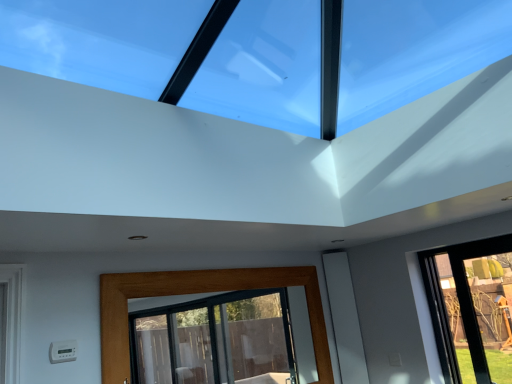
The height and width of the screenshot is (384, 512). Describe the element at coordinates (197, 293) in the screenshot. I see `wooden-framed glass door at lower center, marked as the 1th window in a bottom-to-top arrangement` at that location.

At what (x,y) coordinates should I click in order to perform the action: click on wooden-framed glass door at lower center, which is counted as the second window, starting from the top. Please return your answer as a coordinate pair (x, y). Looking at the image, I should click on (197, 293).

How much space does wooden-framed glass door at lower center, which is counted as the second window, starting from the top, occupy horizontally?

wooden-framed glass door at lower center, which is counted as the second window, starting from the top, is 1.55 inches wide.

Measure the distance between point (341, 56) and camera.

The distance of point (341, 56) from camera is 4.03 meters.

Image resolution: width=512 pixels, height=384 pixels. I want to click on transparent glass window at upper center, placed as the 1th window when sorted from top to bottom, so click(x=261, y=53).

The width and height of the screenshot is (512, 384). Describe the element at coordinates (261, 53) in the screenshot. I see `transparent glass window at upper center, which ranks as the second window in bottom-to-top order` at that location.

At what (x,y) coordinates should I click in order to perform the action: click on wooden-framed glass door at lower center, which is counted as the second window, starting from the top. Please return your answer as a coordinate pair (x, y). Looking at the image, I should click on (197, 293).

Based on the photo, does wooden-framed glass door at lower center, which is counted as the second window, starting from the top, appear on the right side of transparent glass window at upper center, which ranks as the second window in bottom-to-top order?

In fact, wooden-framed glass door at lower center, which is counted as the second window, starting from the top, is to the left of transparent glass window at upper center, which ranks as the second window in bottom-to-top order.

Between wooden-framed glass door at lower center, marked as the 1th window in a bottom-to-top arrangement, and transparent glass window at upper center, placed as the 1th window when sorted from top to bottom, which one is positioned behind?

wooden-framed glass door at lower center, marked as the 1th window in a bottom-to-top arrangement, is more distant.

Considering the positions of point (112, 362) and point (246, 40), is point (112, 362) closer or farther from the camera than point (246, 40)?

Point (112, 362).

From the image's perspective, is wooden-framed glass door at lower center, which is counted as the second window, starting from the top, on top of transparent glass window at upper center, placed as the 1th window when sorted from top to bottom?

No.

From a real-world perspective, who is located lower, wooden-framed glass door at lower center, marked as the 1th window in a bottom-to-top arrangement, or transparent glass window at upper center, placed as the 1th window when sorted from top to bottom?

wooden-framed glass door at lower center, marked as the 1th window in a bottom-to-top arrangement, from a real-world perspective.

Between wooden-framed glass door at lower center, which is counted as the second window, starting from the top, and transparent glass window at upper center, placed as the 1th window when sorted from top to bottom, which one has larger width?

transparent glass window at upper center, placed as the 1th window when sorted from top to bottom, is wider.

Is wooden-framed glass door at lower center, marked as the 1th window in a bottom-to-top arrangement, taller or shorter than transparent glass window at upper center, which ranks as the second window in bottom-to-top order?

Considering their sizes, wooden-framed glass door at lower center, marked as the 1th window in a bottom-to-top arrangement, has more height than transparent glass window at upper center, which ranks as the second window in bottom-to-top order.

Looking at this image, looking at the image, does wooden-framed glass door at lower center, which is counted as the second window, starting from the top, seem bigger or smaller compared to transparent glass window at upper center, which ranks as the second window in bottom-to-top order?

In the image, wooden-framed glass door at lower center, which is counted as the second window, starting from the top, appears to be smaller than transparent glass window at upper center, which ranks as the second window in bottom-to-top order.

Is wooden-framed glass door at lower center, marked as the 1th window in a bottom-to-top arrangement, outside of transparent glass window at upper center, placed as the 1th window when sorted from top to bottom?

wooden-framed glass door at lower center, marked as the 1th window in a bottom-to-top arrangement, lies outside transparent glass window at upper center, placed as the 1th window when sorted from top to bottom,'s area.

Is the surface of wooden-framed glass door at lower center, marked as the 1th window in a bottom-to-top arrangement, in direct contact with transparent glass window at upper center, which ranks as the second window in bottom-to-top order?

No, wooden-framed glass door at lower center, marked as the 1th window in a bottom-to-top arrangement, is not beside transparent glass window at upper center, which ranks as the second window in bottom-to-top order.

Is wooden-framed glass door at lower center, which is counted as the second window, starting from the top, oriented away from transparent glass window at upper center, which ranks as the second window in bottom-to-top order?

No, wooden-framed glass door at lower center, which is counted as the second window, starting from the top,'s orientation is not away from transparent glass window at upper center, which ranks as the second window in bottom-to-top order.

How different are the orientations of wooden-framed glass door at lower center, which is counted as the second window, starting from the top, and transparent glass window at upper center, placed as the 1th window when sorted from top to bottom, in degrees?

There is a 90.1-degree angle between the facing directions of wooden-framed glass door at lower center, which is counted as the second window, starting from the top, and transparent glass window at upper center, placed as the 1th window when sorted from top to bottom.

Measure the distance between wooden-framed glass door at lower center, which is counted as the second window, starting from the top, and transparent glass window at upper center, placed as the 1th window when sorted from top to bottom.

wooden-framed glass door at lower center, which is counted as the second window, starting from the top, is 1.31 meters from transparent glass window at upper center, placed as the 1th window when sorted from top to bottom.

Where is `window located on the right of wooden-framed glass door at lower center, which is counted as the second window, starting from the top`? The width and height of the screenshot is (512, 384). window located on the right of wooden-framed glass door at lower center, which is counted as the second window, starting from the top is located at coordinates (261, 53).

Which object is positioned more to the right, transparent glass window at upper center, placed as the 1th window when sorted from top to bottom, or wooden-framed glass door at lower center, marked as the 1th window in a bottom-to-top arrangement?

From the viewer's perspective, transparent glass window at upper center, placed as the 1th window when sorted from top to bottom, appears more on the right side.

Based on the photo, which object is closer to the camera, transparent glass window at upper center, which ranks as the second window in bottom-to-top order, or wooden-framed glass door at lower center, marked as the 1th window in a bottom-to-top arrangement?

Positioned in front is transparent glass window at upper center, which ranks as the second window in bottom-to-top order.

Is point (240, 52) farther from camera compared to point (104, 311)?

That is True.

Consider the image. From the image's perspective, would you say transparent glass window at upper center, which ranks as the second window in bottom-to-top order, is shown under wooden-framed glass door at lower center, which is counted as the second window, starting from the top?

No, from the image's perspective, transparent glass window at upper center, which ranks as the second window in bottom-to-top order, is not beneath wooden-framed glass door at lower center, which is counted as the second window, starting from the top.

From a real-world perspective, is transparent glass window at upper center, which ranks as the second window in bottom-to-top order, above or below wooden-framed glass door at lower center, which is counted as the second window, starting from the top?

Clearly, from a real-world perspective, transparent glass window at upper center, which ranks as the second window in bottom-to-top order, is above wooden-framed glass door at lower center, which is counted as the second window, starting from the top.

Is transparent glass window at upper center, placed as the 1th window when sorted from top to bottom, thinner than wooden-framed glass door at lower center, marked as the 1th window in a bottom-to-top arrangement?

No, transparent glass window at upper center, placed as the 1th window when sorted from top to bottom, is not thinner than wooden-framed glass door at lower center, marked as the 1th window in a bottom-to-top arrangement.

Which of these two, transparent glass window at upper center, which ranks as the second window in bottom-to-top order, or wooden-framed glass door at lower center, marked as the 1th window in a bottom-to-top arrangement, stands shorter?

With less height is transparent glass window at upper center, which ranks as the second window in bottom-to-top order.

Does transparent glass window at upper center, which ranks as the second window in bottom-to-top order, have a smaller size compared to wooden-framed glass door at lower center, marked as the 1th window in a bottom-to-top arrangement?

Incorrect, transparent glass window at upper center, which ranks as the second window in bottom-to-top order, is not smaller in size than wooden-framed glass door at lower center, marked as the 1th window in a bottom-to-top arrangement.

Is transparent glass window at upper center, which ranks as the second window in bottom-to-top order, located outside wooden-framed glass door at lower center, marked as the 1th window in a bottom-to-top arrangement?

That's correct, transparent glass window at upper center, which ranks as the second window in bottom-to-top order, is outside of wooden-framed glass door at lower center, marked as the 1th window in a bottom-to-top arrangement.

Are transparent glass window at upper center, which ranks as the second window in bottom-to-top order, and wooden-framed glass door at lower center, which is counted as the second window, starting from the top, located far from each other?

transparent glass window at upper center, which ranks as the second window in bottom-to-top order, is positioned a significant distance from wooden-framed glass door at lower center, which is counted as the second window, starting from the top.

Is transparent glass window at upper center, placed as the 1th window when sorted from top to bottom, oriented towards wooden-framed glass door at lower center, marked as the 1th window in a bottom-to-top arrangement?

No.

How many degrees apart are the facing directions of transparent glass window at upper center, which ranks as the second window in bottom-to-top order, and wooden-framed glass door at lower center, marked as the 1th window in a bottom-to-top arrangement?

They differ by 90.1 degrees in their facing directions.

Measure the distance from transparent glass window at upper center, which ranks as the second window in bottom-to-top order, to wooden-framed glass door at lower center, which is counted as the second window, starting from the top.

transparent glass window at upper center, which ranks as the second window in bottom-to-top order, and wooden-framed glass door at lower center, which is counted as the second window, starting from the top, are 1.31 meters apart from each other.

Locate an element on the screen. Image resolution: width=512 pixels, height=384 pixels. window that appears on the right of wooden-framed glass door at lower center, marked as the 1th window in a bottom-to-top arrangement is located at coordinates (261, 53).

This screenshot has height=384, width=512. What are the coordinates of `window behind the transparent glass window at upper center, which ranks as the second window in bottom-to-top order` in the screenshot? It's located at (197, 293).

Where is `window that is on the left side of transparent glass window at upper center, which ranks as the second window in bottom-to-top order`? Image resolution: width=512 pixels, height=384 pixels. window that is on the left side of transparent glass window at upper center, which ranks as the second window in bottom-to-top order is located at coordinates (197, 293).